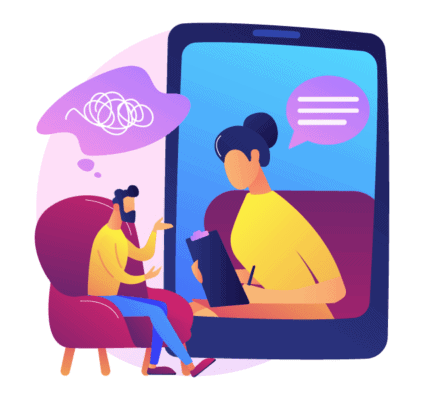
Where is `clipboard`? The width and height of the screenshot is (428, 400). clipboard is located at coordinates (208, 274).